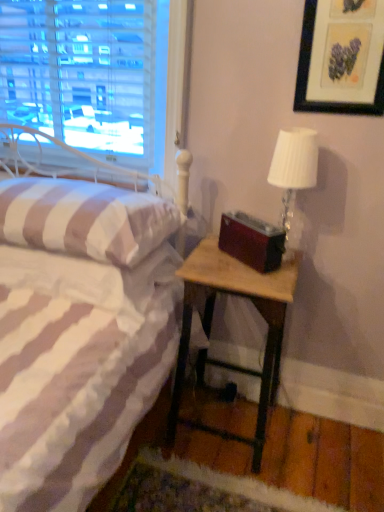
Question: Can you confirm if white striped fabric pillow at left is smaller than white textured lampshade at upper right?

Choices:
 (A) yes
 (B) no

Answer: (B)

Question: Is white textured lampshade at upper right completely or partially inside white striped fabric pillow at left?

Choices:
 (A) yes
 (B) no

Answer: (B)

Question: From the image's perspective, is white striped fabric pillow at left located beneath white textured lampshade at upper right?

Choices:
 (A) no
 (B) yes

Answer: (B)

Question: Considering the relative positions of white striped fabric pillow at left and white textured lampshade at upper right in the image provided, is white striped fabric pillow at left to the left of white textured lampshade at upper right from the viewer's perspective?

Choices:
 (A) no
 (B) yes

Answer: (B)

Question: Is white striped fabric pillow at left bigger than white textured lampshade at upper right?

Choices:
 (A) yes
 (B) no

Answer: (A)

Question: From a real-world perspective, is white striped fabric pillow at left positioned over white textured lampshade at upper right based on gravity?

Choices:
 (A) yes
 (B) no

Answer: (B)

Question: Is wooden nightstand at lower right not inside matte black picture frame at upper right?

Choices:
 (A) no
 (B) yes

Answer: (B)

Question: Is wooden nightstand at lower right thinner than matte black picture frame at upper right?

Choices:
 (A) yes
 (B) no

Answer: (B)

Question: Can you confirm if wooden nightstand at lower right is positioned to the left of matte black picture frame at upper right?

Choices:
 (A) yes
 (B) no

Answer: (A)

Question: Is wooden nightstand at lower right facing away from matte black picture frame at upper right?

Choices:
 (A) no
 (B) yes

Answer: (A)

Question: Is the position of wooden nightstand at lower right more distant than that of matte black picture frame at upper right?

Choices:
 (A) yes
 (B) no

Answer: (A)

Question: Can you confirm if wooden nightstand at lower right is taller than matte black picture frame at upper right?

Choices:
 (A) no
 (B) yes

Answer: (B)

Question: Is the position of matte black picture frame at upper right less distant than that of white striped fabric pillow at left?

Choices:
 (A) yes
 (B) no

Answer: (B)